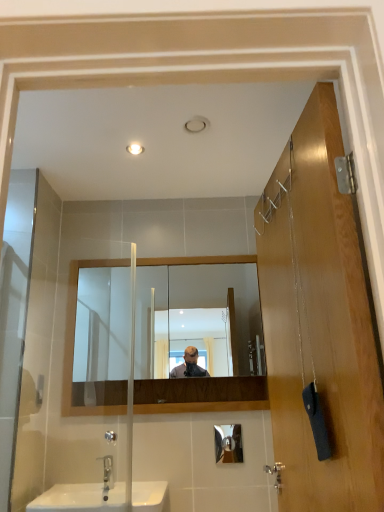
Question: Is wooden door at right a part of silver metallic faucet at lower left?

Choices:
 (A) no
 (B) yes

Answer: (A)

Question: Would you say silver metallic faucet at lower left is outside wooden door at right?

Choices:
 (A) no
 (B) yes

Answer: (B)

Question: From a real-world perspective, is silver metallic faucet at lower left located higher than wooden door at right?

Choices:
 (A) no
 (B) yes

Answer: (A)

Question: From the image's perspective, is silver metallic faucet at lower left on top of wooden door at right?

Choices:
 (A) no
 (B) yes

Answer: (A)

Question: Considering the relative positions of silver metallic faucet at lower left and wooden door at right in the image provided, is silver metallic faucet at lower left behind wooden door at right?

Choices:
 (A) no
 (B) yes

Answer: (B)

Question: Is silver metallic faucet at lower left bigger or smaller than clear glass mirror at center?

Choices:
 (A) big
 (B) small

Answer: (B)

Question: In the image, is silver metallic faucet at lower left on the left side or the right side of clear glass mirror at center?

Choices:
 (A) left
 (B) right

Answer: (A)

Question: From the image's perspective, is silver metallic faucet at lower left above or below clear glass mirror at center?

Choices:
 (A) above
 (B) below

Answer: (B)

Question: From a real-world perspective, is silver metallic faucet at lower left positioned above or below clear glass mirror at center?

Choices:
 (A) below
 (B) above

Answer: (A)

Question: In terms of width, does wooden door at right look wider or thinner when compared to white glossy sink at lower left?

Choices:
 (A) wide
 (B) thin

Answer: (B)

Question: Does point (286, 375) appear closer or farther from the camera than point (94, 497)?

Choices:
 (A) farther
 (B) closer

Answer: (B)

Question: Would you say wooden door at right is to the left or to the right of white glossy sink at lower left in the picture?

Choices:
 (A) left
 (B) right

Answer: (B)

Question: Is wooden door at right inside the boundaries of white glossy sink at lower left, or outside?

Choices:
 (A) outside
 (B) inside

Answer: (A)

Question: Relative to silver metallic faucet at lower left, is wooden door at right in front or behind?

Choices:
 (A) front
 (B) behind

Answer: (A)

Question: In the image, is wooden door at right on the left side or the right side of silver metallic faucet at lower left?

Choices:
 (A) left
 (B) right

Answer: (B)